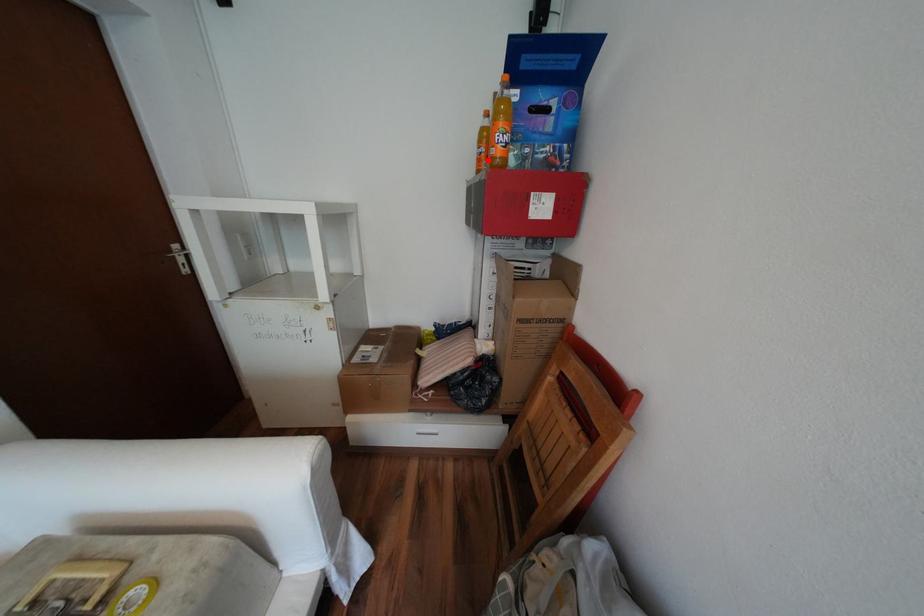
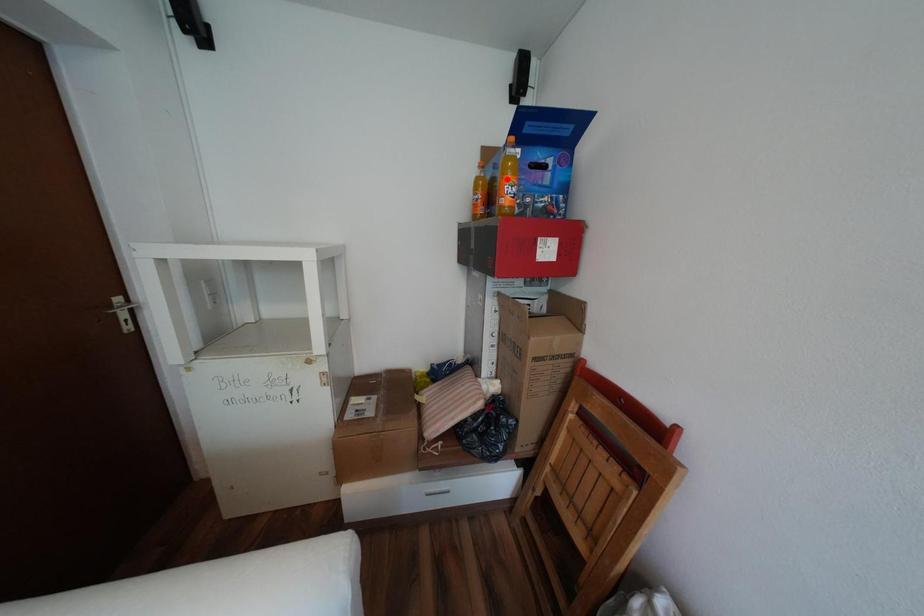
I am providing you with two images of the same scene from different viewpoints. A red point is marked on the first image and another point is marked on the second image. Is the marked point in image1 the same physical position as the marked point in image2?

No